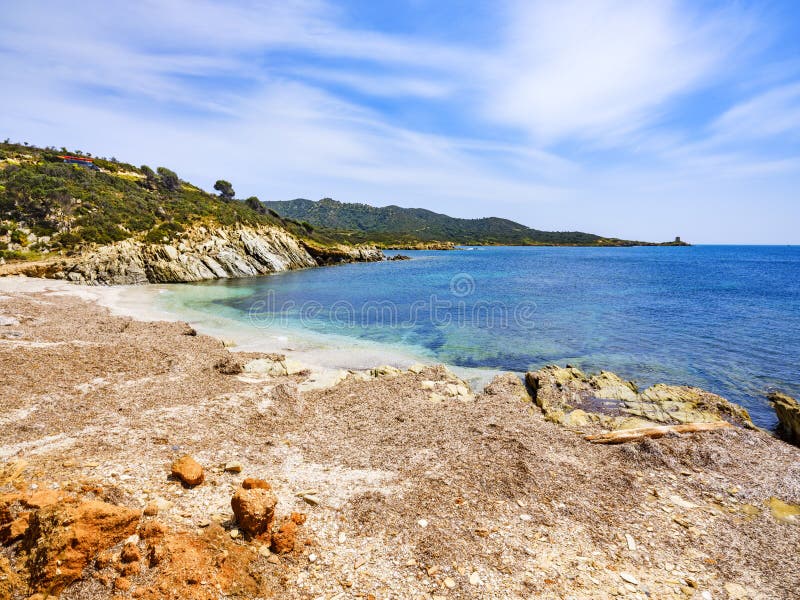
At what (x,y) coordinates should I click in order to perform the action: click on trash. Please return your answer as a coordinate pair (x, y). The width and height of the screenshot is (800, 600). Looking at the image, I should click on (606, 413).